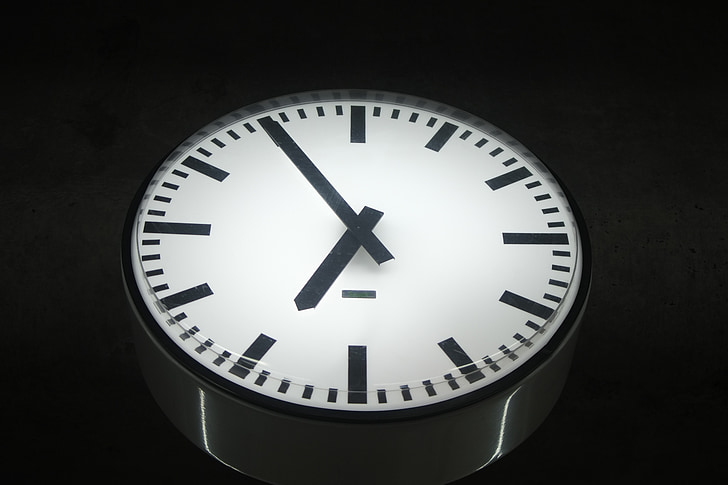
Image resolution: width=728 pixels, height=485 pixels. I want to click on light reflection on clock, so click(202, 422), click(502, 417), click(490, 460), click(210, 452).